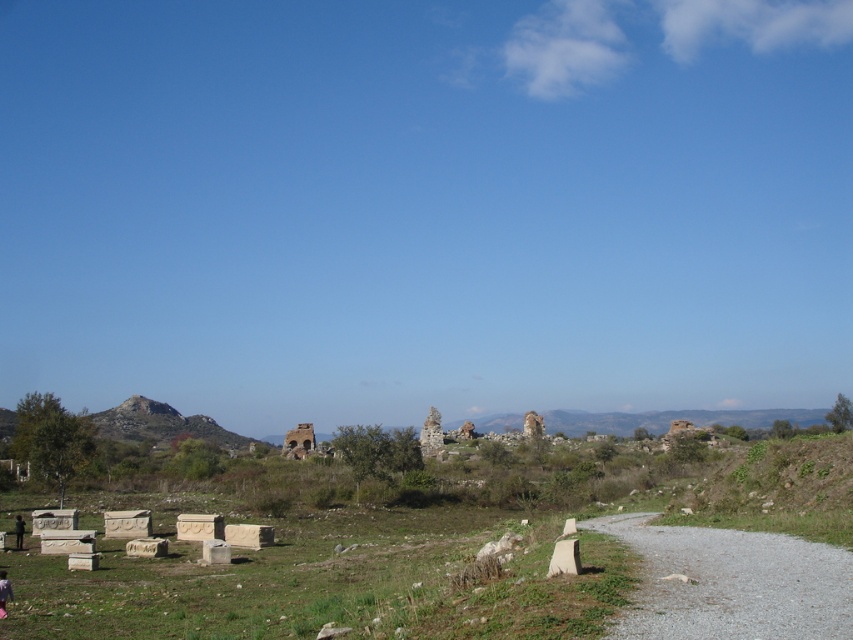
Question: Does pink fabric pants at lower left have a larger size compared to dark green fabric at lower left?

Choices:
 (A) no
 (B) yes

Answer: (A)

Question: Which object is farther from the camera taking this photo?

Choices:
 (A) pink fabric pants at lower left
 (B) gravelly dirt path at lower right
 (C) weathered stone ruins at center
 (D) dark green fabric at lower left

Answer: (C)

Question: Is gravelly dirt path at lower right thinner than pink fabric pants at lower left?

Choices:
 (A) no
 (B) yes

Answer: (A)

Question: From the image, what is the correct spatial relationship of weathered stone ruins at center in relation to dark green fabric at lower left?

Choices:
 (A) right
 (B) left

Answer: (A)

Question: Which of the following is the farthest from the observer?

Choices:
 (A) (788, 630)
 (B) (18, 548)

Answer: (B)

Question: Estimate the real-world distances between objects in this image. Which object is farther from the weathered stone ruins at center?

Choices:
 (A) dark green fabric at lower left
 (B) gravelly dirt path at lower right
 (C) pink fabric pants at lower left

Answer: (C)